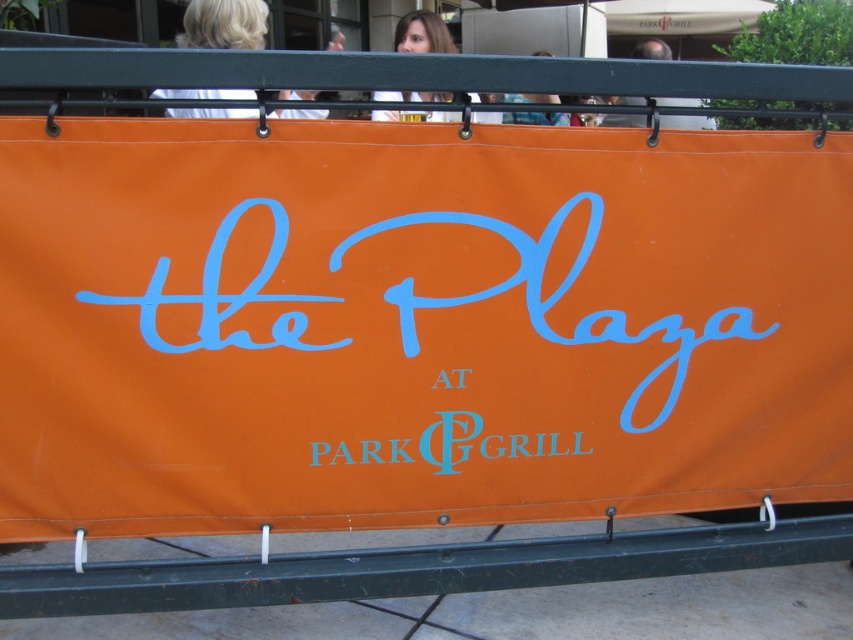
Is point (355, 454) more distant than point (186, 29)?

No, (355, 454) is in front of (186, 29).

The width and height of the screenshot is (853, 640). What do you see at coordinates (448, 444) in the screenshot?
I see `bluecursive text at center` at bounding box center [448, 444].

Locate an element on the screen. bluecursive text at center is located at coordinates pos(448,444).

Which of these two, orange fabric sign at center or smooth skin head at upper center, stands shorter?

With less height is smooth skin head at upper center.

What do you see at coordinates (415, 324) in the screenshot?
I see `orange fabric sign at center` at bounding box center [415, 324].

Which is in front, point (688, 218) or point (605, 124)?

Point (688, 218)

Locate an element on the screen. The image size is (853, 640). orange fabric sign at center is located at coordinates (415, 324).

Does orange fabric sign at center appear over bluecursive text at center?

Yes.

Does point (409, 134) come behind point (489, 436)?

No, (409, 134) is closer to viewer.

Is point (474, 204) less distant than point (444, 442)?

Yes, point (474, 204) is closer to viewer.

This screenshot has width=853, height=640. In order to click on orange fabric sign at center in this screenshot , I will do `click(415, 324)`.